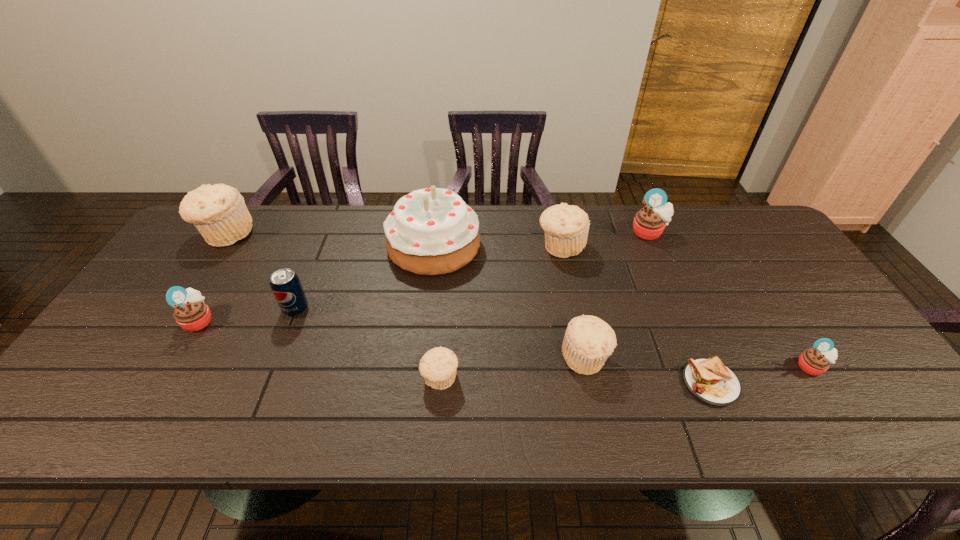
The image size is (960, 540). In the image, there is a desktop. Identify the location of free region at the near edge. (410, 409).

Image resolution: width=960 pixels, height=540 pixels. I want to click on free space at the right edge of the desktop, so click(773, 291).

Find the location of `vacant space at the near left corner`. vacant space at the near left corner is located at coordinates (128, 404).

This screenshot has width=960, height=540. What are the coordinates of `free region at the far right corner of the desktop` in the screenshot? It's located at click(757, 233).

Find the location of a particular element. The width and height of the screenshot is (960, 540). vacant space at the near right corner of the desktop is located at coordinates (880, 402).

At what (x,y) coordinates should I click in order to perform the action: click on free spot between the biggest pink muffin and the second nearest pink muffin. Please return your answer as a coordinate pair (x, y). The image size is (960, 540). Looking at the image, I should click on (424, 276).

Image resolution: width=960 pixels, height=540 pixels. Identify the location of free area in between the second smallest beige muffin and the leftmost pink muffin. (392, 339).

At what (x,y) coordinates should I click in order to perform the action: click on free spot between the third beige muffin from right to left and the red cake. Please return your answer as a coordinate pair (x, y). This screenshot has height=540, width=960. Looking at the image, I should click on (437, 312).

This screenshot has width=960, height=540. What are the coordinates of `free space that is in between the rightmost muffin and the third smallest beige muffin` in the screenshot? It's located at click(x=686, y=307).

Locate an element on the screen. vacant area between the eighth object from right to left and the rightmost muffin is located at coordinates (554, 338).